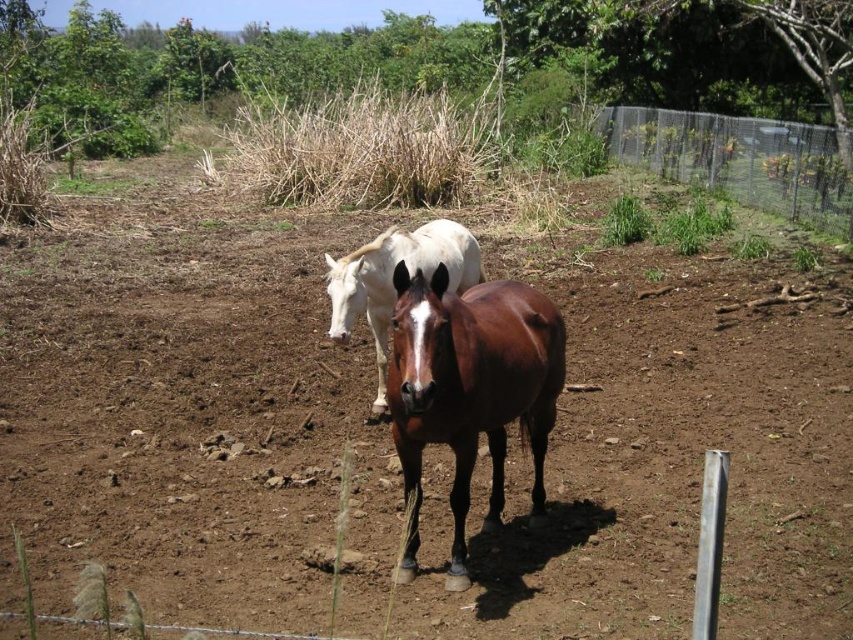
You are a farmer checking the height of your horses. You have a stable door that is 1.8 meters tall. Can both the brown glossy horse at center and the white glossy horse at center pass through the door without bending?

The brown glossy horse at center is much taller than the white glossy horse at center. Since the stable door is 1.8 meters tall, only the white glossy horse at center can pass through without bending, while the brown glossy horse at center may need to lower its head or the door is too short.

You are a photographer positioned to the left of the two horses. You want to take a photo that includes both the brown glossy horse at center and the white glossy horse at center. Which horse should you adjust your position to face more towards to ensure both are in frame?

Since the brown glossy horse at center is to the right of the white glossy horse at center, you should adjust your position to face slightly towards the brown glossy horse at center to ensure both are in frame.

You are a photographer standing in the middle of the fenced area where the two horses are located. You want to capture a photo that includes both the brown horse facing you and the metallic wire mesh at upper right. Given that your camera has a maximum focus range of 40 feet, will you be able to keep both subjects in focus simultaneously?

The metallic wire mesh at upper right is 39.10 feet away from the viewer, which is within the camera maximum focus range of 40 feet. Therefore, both the brown horse and the metallic wire mesh at upper right can be in focus in the same photo.